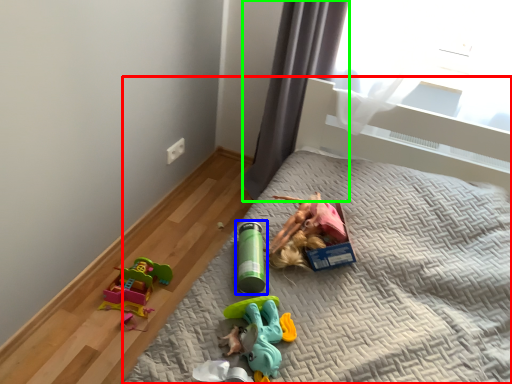
Question: Based on their relative distances, which object is nearer to bed (highlighted by a red box)? Choose from toy (highlighted by a blue box) and curtain (highlighted by a green box).

Choices:
 (A) toy
 (B) curtain

Answer: (A)